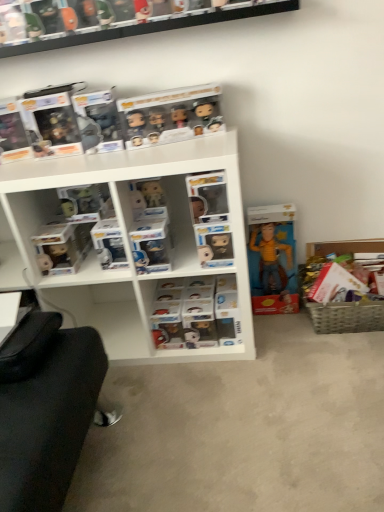
Question: Considering the relative sizes of woven basket at lower right and matte black figurine at left, which is the 1th toy from left to right, in the image provided, is woven basket at lower right thinner than matte black figurine at left, which is the 1th toy from left to right,?

Choices:
 (A) yes
 (B) no

Answer: (B)

Question: Does woven basket at lower right have a lesser height compared to matte black figurine at left, positioned as the 2th toy in right-to-left order?

Choices:
 (A) no
 (B) yes

Answer: (A)

Question: Are woven basket at lower right and matte black figurine at left, which is the 1th toy from left to right, making contact?

Choices:
 (A) no
 (B) yes

Answer: (A)

Question: From the image's perspective, does woven basket at lower right appear higher than matte black figurine at left, positioned as the 2th toy in right-to-left order?

Choices:
 (A) no
 (B) yes

Answer: (A)

Question: Can you confirm if woven basket at lower right is bigger than matte black figurine at left, which is the 1th toy from left to right?

Choices:
 (A) yes
 (B) no

Answer: (A)

Question: In terms of height, does woven basket at lower right look taller or shorter compared to matte black figurine at left, positioned as the 2th toy in right-to-left order?

Choices:
 (A) short
 (B) tall

Answer: (B)

Question: Considering their positions, is woven basket at lower right located in front of or behind matte black figurine at left, which is the 1th toy from left to right?

Choices:
 (A) behind
 (B) front

Answer: (A)

Question: Considering the positions of woven basket at lower right and matte black figurine at left, which is the 1th toy from left to right, in the image, is woven basket at lower right wider or thinner than matte black figurine at left, which is the 1th toy from left to right,?

Choices:
 (A) thin
 (B) wide

Answer: (B)

Question: Considering the relative positions of woven basket at lower right and matte black figurine at left, positioned as the 2th toy in right-to-left order, in the image provided, is woven basket at lower right to the left or to the right of matte black figurine at left, positioned as the 2th toy in right-to-left order,?

Choices:
 (A) left
 (B) right

Answer: (B)

Question: Considering the positions of clear plastic figurines at upper center, which is the 1th shelf from top to bottom, and yellow fabric doll at center, the first toy positioned from the right, in the image, is clear plastic figurines at upper center, which is the 1th shelf from top to bottom, wider or thinner than yellow fabric doll at center, the first toy positioned from the right,?

Choices:
 (A) thin
 (B) wide

Answer: (B)

Question: Is clear plastic figurines at upper center, the 2th shelf positioned from the bottom, spatially inside yellow fabric doll at center, which appears as the 2th toy when viewed from the left, or outside of it?

Choices:
 (A) inside
 (B) outside

Answer: (B)

Question: Considering the positions of clear plastic figurines at upper center, the 2th shelf positioned from the bottom, and yellow fabric doll at center, which appears as the 2th toy when viewed from the left, in the image, is clear plastic figurines at upper center, the 2th shelf positioned from the bottom, bigger or smaller than yellow fabric doll at center, which appears as the 2th toy when viewed from the left,?

Choices:
 (A) big
 (B) small

Answer: (B)

Question: From a real-world perspective, is clear plastic figurines at upper center, the 2th shelf positioned from the bottom, positioned above or below yellow fabric doll at center, the first toy positioned from the right?

Choices:
 (A) above
 (B) below

Answer: (A)

Question: Looking at their shapes, would you say clear plastic figures at center is wider or thinner than woven basket at lower right?

Choices:
 (A) wide
 (B) thin

Answer: (A)

Question: In terms of height, does clear plastic figures at center look taller or shorter compared to woven basket at lower right?

Choices:
 (A) tall
 (B) short

Answer: (B)